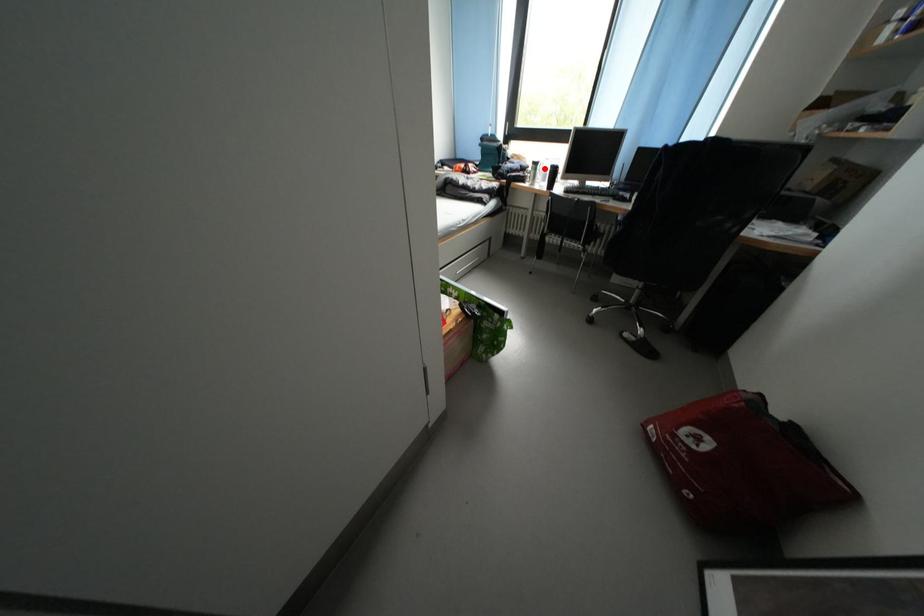
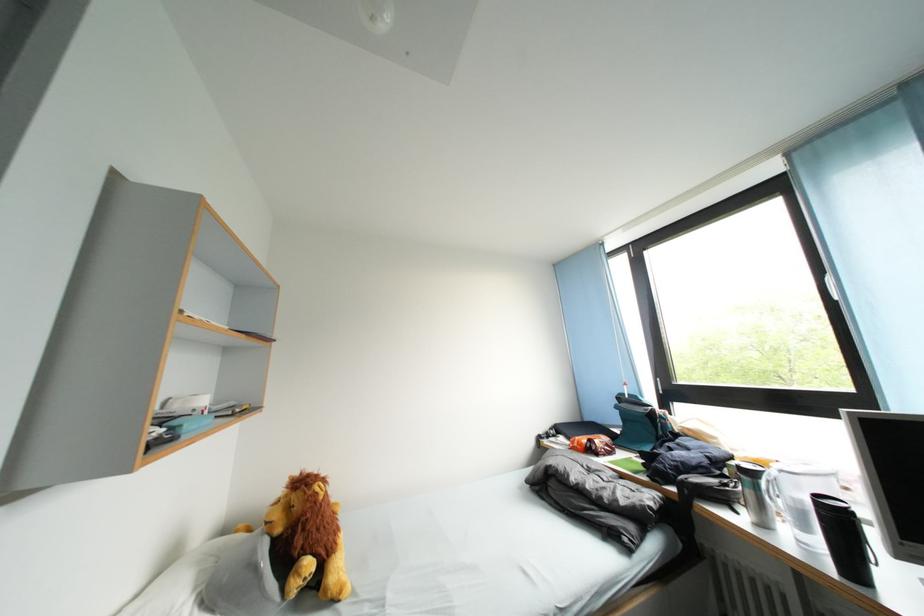
The point at the highlighted location is marked in the first image. Where is the corresponding point in the second image?

(759, 479)